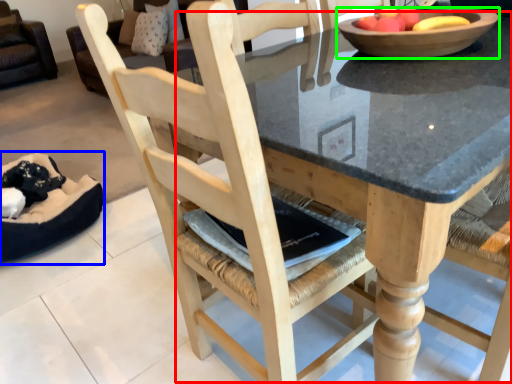
Question: Which object is positioned farthest from round table (highlighted by a red box)? Select from bean bag chair (highlighted by a blue box) and bowl (highlighted by a green box).

Choices:
 (A) bean bag chair
 (B) bowl

Answer: (A)